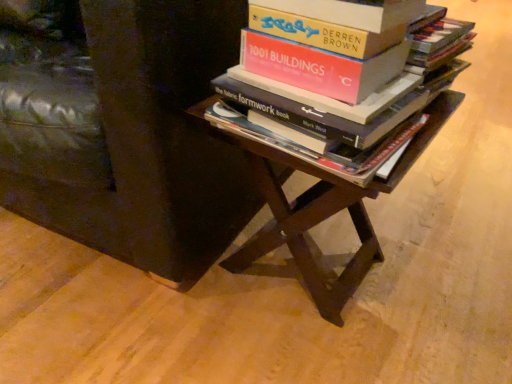
Identify the location of vacant area situated below brown wooden table at center (from a real-world perspective). This screenshot has height=384, width=512. (293, 279).